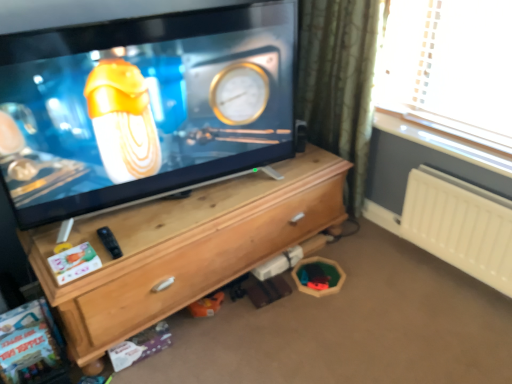
Where is `vacant area situated below matte black tv at center (from a real-world perspective)`? The height and width of the screenshot is (384, 512). vacant area situated below matte black tv at center (from a real-world perspective) is located at coordinates (178, 205).